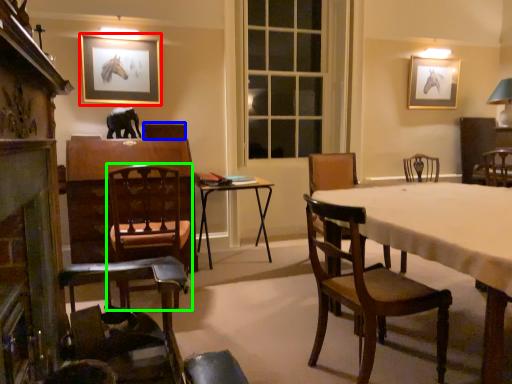
Question: Estimate the real-world distances between objects in this image. Which object is closer to picture frame (highlighted by a red box), armchair (highlighted by a blue box) or chair (highlighted by a green box)?

Choices:
 (A) armchair
 (B) chair

Answer: (A)